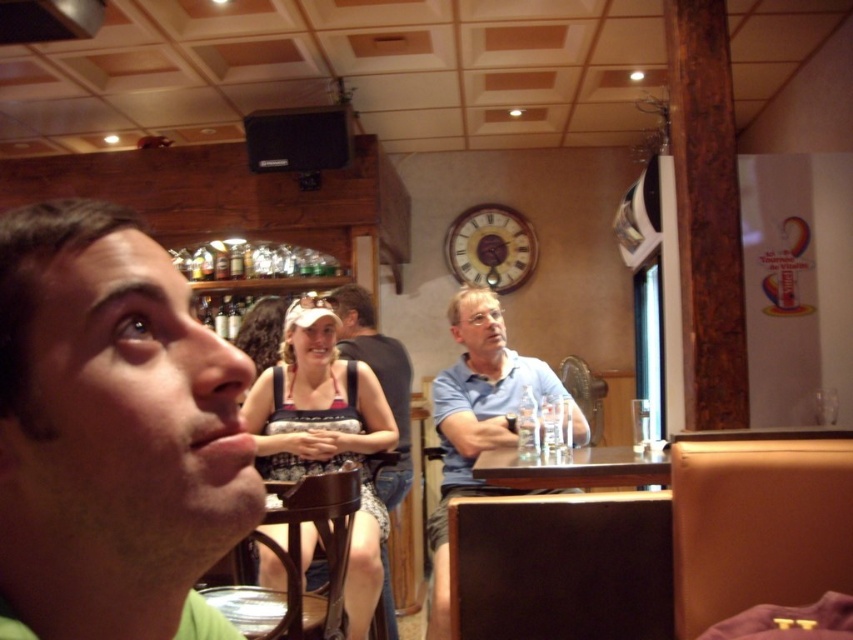
Question: Which object is farther from the camera taking this photo?

Choices:
 (A) patterned fabric tank top at center
 (B) blue cotton shirt at center

Answer: (B)

Question: Does blue cotton shirt at center lie behind matte black tank top at center?

Choices:
 (A) no
 (B) yes

Answer: (A)

Question: Is matte black tank top at center positioned in front of brown wooden table at center?

Choices:
 (A) no
 (B) yes

Answer: (A)

Question: Which point is closer to the camera taking this photo?

Choices:
 (A) (624, 449)
 (B) (393, 349)

Answer: (A)

Question: Does green matte shirt at left have a greater width compared to matte black tank top at center?

Choices:
 (A) no
 (B) yes

Answer: (A)

Question: Among these objects, which one is nearest to the camera?

Choices:
 (A) brown wooden table at center
 (B) matte black tank top at center

Answer: (A)